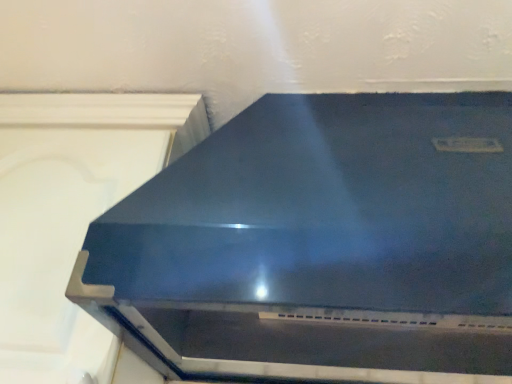
Locate an element on the screen. The height and width of the screenshot is (384, 512). blank space above satin blue oven at center (from a real-world perspective) is located at coordinates pos(364,65).